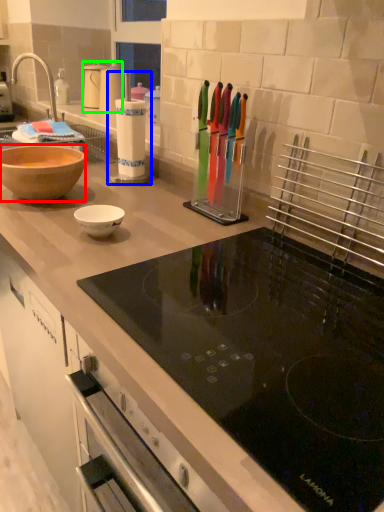
Question: Based on their relative distances, which object is nearer to bowl (highlighted by a red box)? Choose from appliance (highlighted by a blue box) and kitchen appliance (highlighted by a green box).

Choices:
 (A) appliance
 (B) kitchen appliance

Answer: (A)